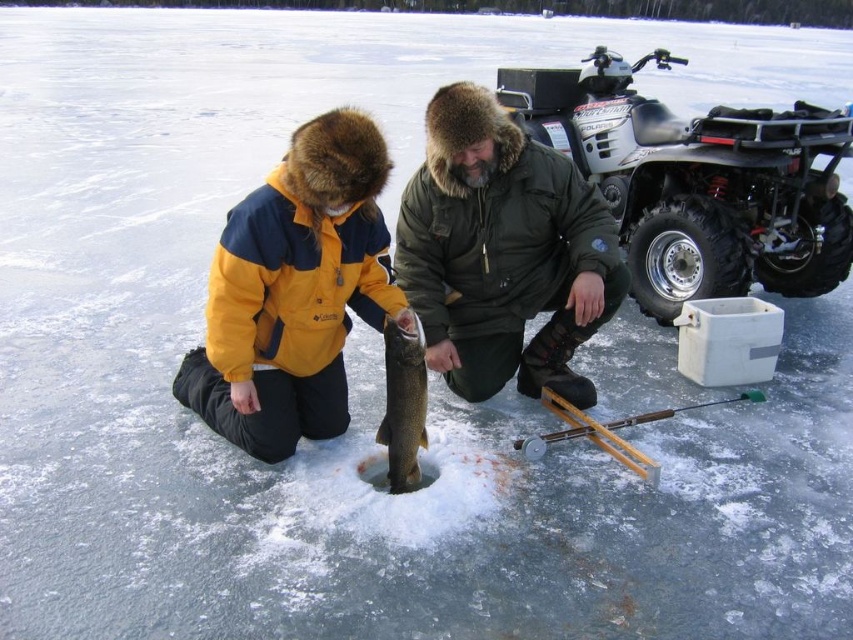
Question: Estimate the real-world distances between objects in this image. Which object is closer to the wooden fishing pole at lower center?

Choices:
 (A) yellow fleece jacket at center
 (B) shiny silver fish at center
 (C) green matte jacket at center
 (D) white matte snowmobile at upper right

Answer: (B)

Question: Which object is closer to the camera taking this photo?

Choices:
 (A) shiny silver fish at center
 (B) yellow fleece jacket at center
 (C) wooden fishing pole at lower center
 (D) white matte snowmobile at upper right

Answer: (B)

Question: Considering the relative positions of yellow fleece jacket at center and shiny silver fish at center in the image provided, where is yellow fleece jacket at center located with respect to shiny silver fish at center?

Choices:
 (A) right
 (B) left

Answer: (B)

Question: Can you confirm if white matte snowmobile at upper right is positioned below yellow fleece jacket at center?

Choices:
 (A) yes
 (B) no

Answer: (B)

Question: Among these points, which one is nearest to the camera?

Choices:
 (A) (511, 106)
 (B) (258, 237)

Answer: (B)

Question: Is white matte snowmobile at upper right to the left of wooden fishing pole at lower center from the viewer's perspective?

Choices:
 (A) no
 (B) yes

Answer: (A)